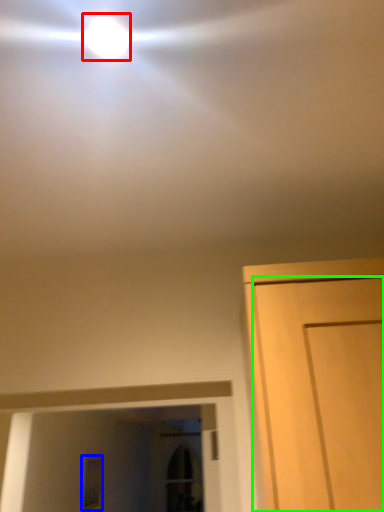
Question: Which object is the closest to the droplight (highlighted by a red box)? Choose among these: window (highlighted by a blue box) or door (highlighted by a green box).

Choices:
 (A) window
 (B) door

Answer: (B)